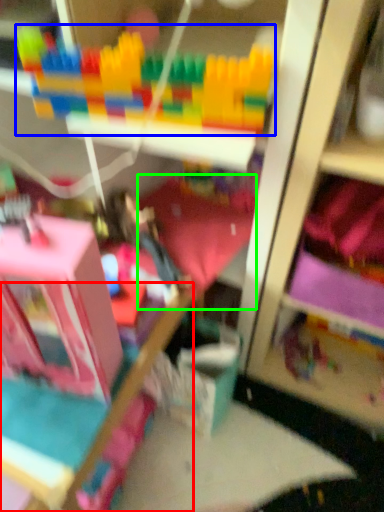
Question: Which object is positioned closest to bed frame (highlighted by a red box)? Select from toy (highlighted by a blue box) and bedding (highlighted by a green box).

Choices:
 (A) toy
 (B) bedding

Answer: (B)